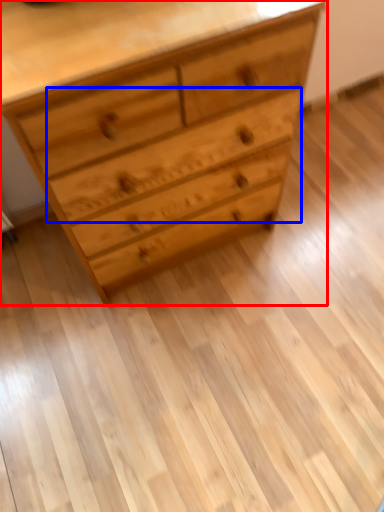
Question: Which object is closer to the camera taking this photo, chest of drawers (highlighted by a red box) or drawer (highlighted by a blue box)?

Choices:
 (A) chest of drawers
 (B) drawer

Answer: (A)